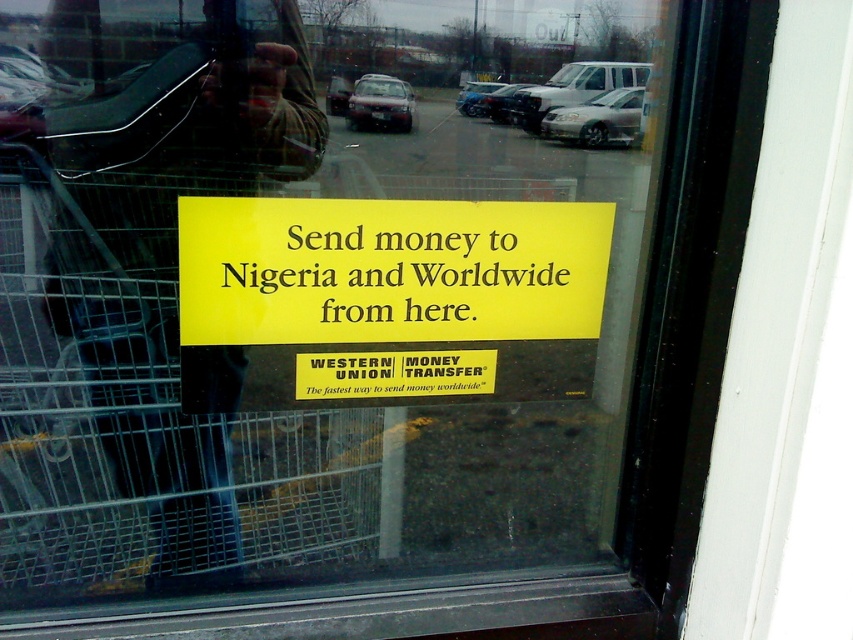
Question: Which object appears farthest from the camera in this image?

Choices:
 (A) metallic shopping cart at center
 (B) yellow matte sign at center

Answer: (B)

Question: Can you confirm if metallic shopping cart at center is positioned to the left of yellow paper sign at center?

Choices:
 (A) yes
 (B) no

Answer: (A)

Question: Can you confirm if metallic shopping cart at center is wider than yellow matte sign at center?

Choices:
 (A) no
 (B) yes

Answer: (A)

Question: Which point is closer to the camera?

Choices:
 (A) (587, 396)
 (B) (103, 152)
 (C) (254, 324)

Answer: (B)

Question: In this image, where is metallic shopping cart at center located relative to yellow paper sign at center?

Choices:
 (A) below
 (B) above

Answer: (A)

Question: Estimate the real-world distances between objects in this image. Which object is farther from the yellow paper sign at center?

Choices:
 (A) yellow matte sign at center
 (B) metallic shopping cart at center

Answer: (B)